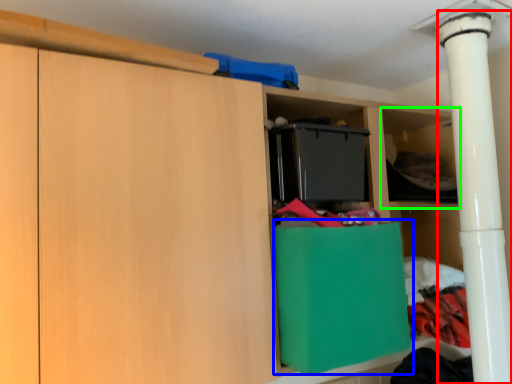
Question: Which is nearer to the pillar (highlighted by a red box)? cabinetry (highlighted by a blue box) or shelf (highlighted by a green box).

Choices:
 (A) cabinetry
 (B) shelf

Answer: (B)